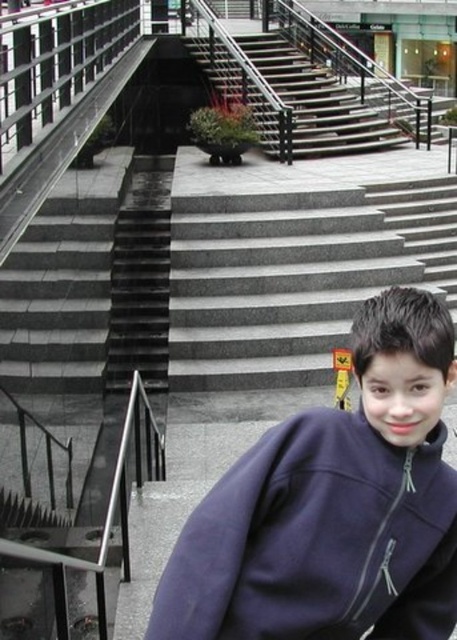
This screenshot has width=457, height=640. What do you see at coordinates (334, 506) in the screenshot? I see `dark blue fleece at center` at bounding box center [334, 506].

Which is above, dark blue fleece at center or dark gray concrete stairs at center?

dark gray concrete stairs at center is higher up.

Locate an element on the screen. dark blue fleece at center is located at coordinates (334, 506).

Find the location of a particular element. The image size is (457, 640). dark blue fleece at center is located at coordinates (334, 506).